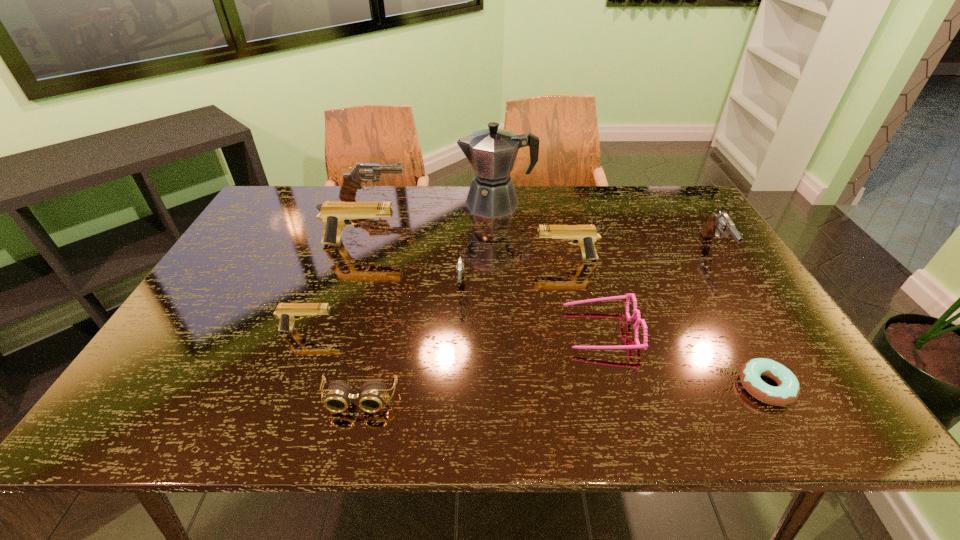
You are a GUI agent. You are given a task and a screenshot of the screen. Output one action in this format:
    pyautogui.click(x=<x>, y=<y>)
    Task: Click on the free space located at the barrel of the biggest tan pistol
    This screenshot has height=540, width=960.
    Given the screenshot: What is the action you would take?
    pyautogui.click(x=517, y=244)

Locate an element on the screen. This screenshot has width=960, height=540. vacant space situated 0.100m at the barrel of the rightmost gray pistol is located at coordinates (743, 293).

Where is `free space located at the barrel of the second farthest tan pistol`? The height and width of the screenshot is (540, 960). free space located at the barrel of the second farthest tan pistol is located at coordinates (490, 259).

The image size is (960, 540). What are the coordinates of `free region located 0.370m at the barrel of the second farthest tan pistol` in the screenshot? It's located at (407, 259).

The image size is (960, 540). I want to click on vacant space located 0.130m at the barrel of the second farthest tan pistol, so click(490, 259).

Find the location of a particular element. The height and width of the screenshot is (540, 960). vacant area situated 0.160m at the barrel of the third pistol from right to left is located at coordinates (458, 354).

Identify the location of vacant space situated 0.090m at the barrel of the smallest tan pistol. The height and width of the screenshot is (540, 960). (373, 330).

I want to click on vacant space located 0.190m on the arms of the pink spectacles, so click(488, 330).

Locate an element on the screen. The height and width of the screenshot is (540, 960). blank space located 0.250m on the arms of the pink spectacles is located at coordinates (463, 330).

I want to click on vacant space located 0.340m on the arms of the pink spectacles, so click(425, 330).